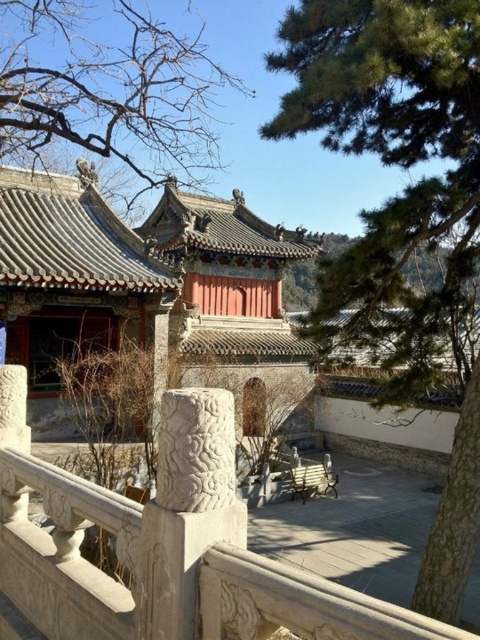
Question: Which of the following is the farthest from the observer?

Choices:
 (A) green textured tree at upper right
 (B) white stone balustrade at center

Answer: (A)

Question: Is green textured tree at upper right further to the viewer compared to matte gray stone palace at center?

Choices:
 (A) yes
 (B) no

Answer: (B)

Question: Is green textured tree at upper right closer to camera compared to matte gray stone palace at center?

Choices:
 (A) no
 (B) yes

Answer: (B)

Question: Which point is farther to the camera?

Choices:
 (A) matte gray stone palace at center
 (B) white stone pillar at center

Answer: (A)

Question: Which point appears closest to the camera in this image?

Choices:
 (A) (96, 228)
 (B) (48, 492)
 (C) (457, 204)

Answer: (B)

Question: Is matte gray stone palace at center positioned before white stone pillar at center?

Choices:
 (A) no
 (B) yes

Answer: (A)